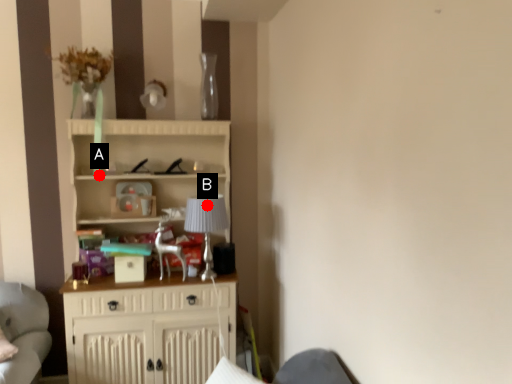
Question: Two points are circled on the image, labeled by A and B beside each circle. Which of the following is the closest to the observer?

Choices:
 (A) A is closer
 (B) B is closer

Answer: (B)